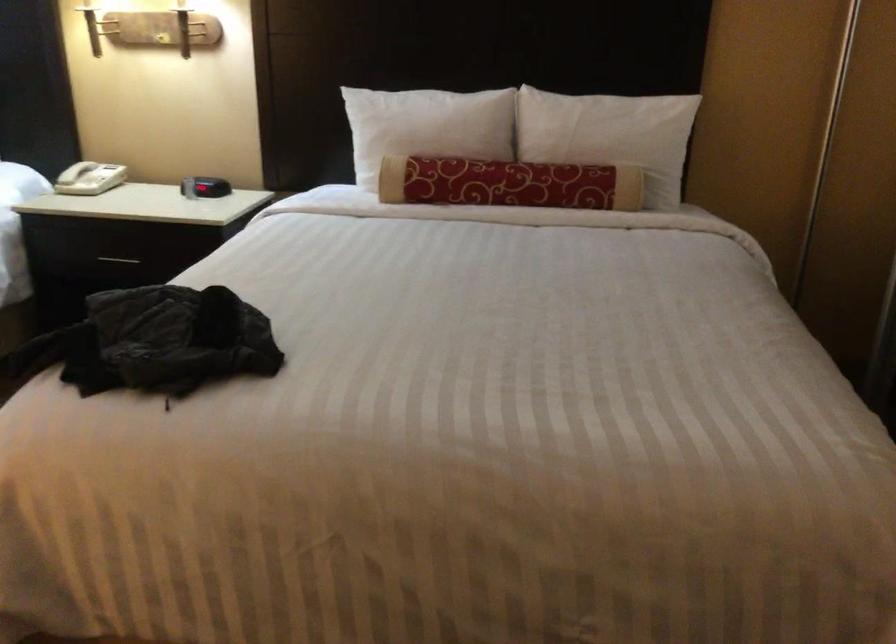
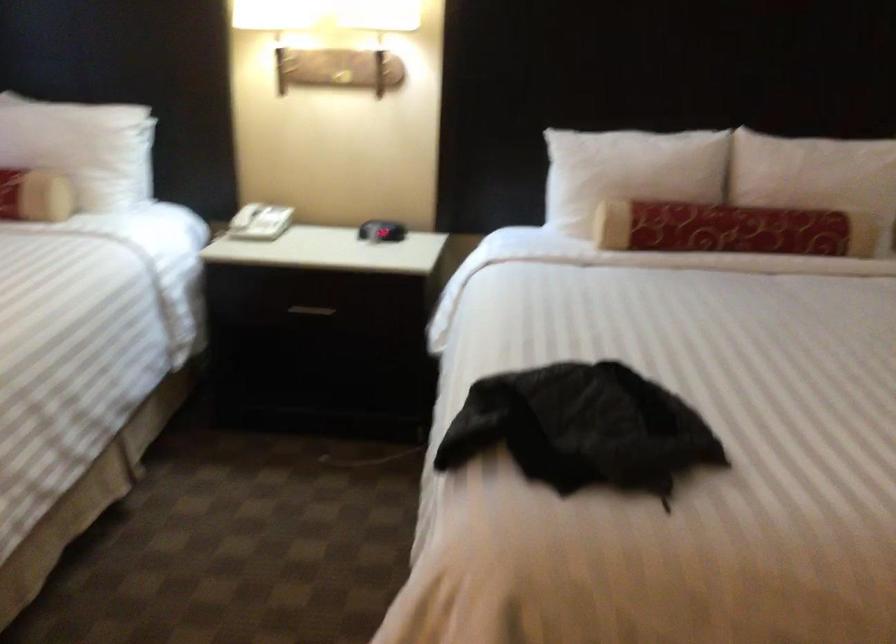
Question: The images are taken continuously from a first-person perspective. In which direction are you moving?

Choices:
 (A) Left
 (B) Right
 (C) Forward
 (D) Backward

Answer: (A)